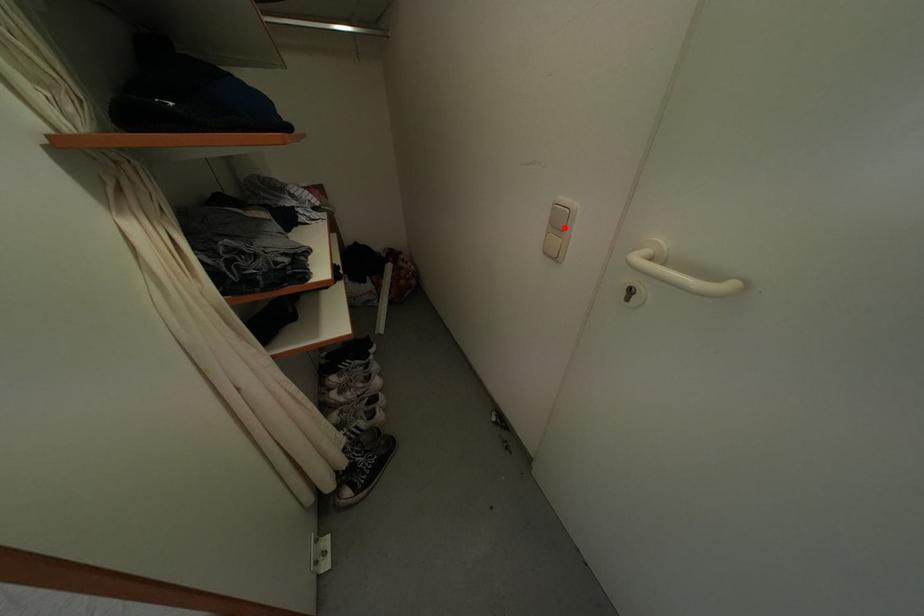
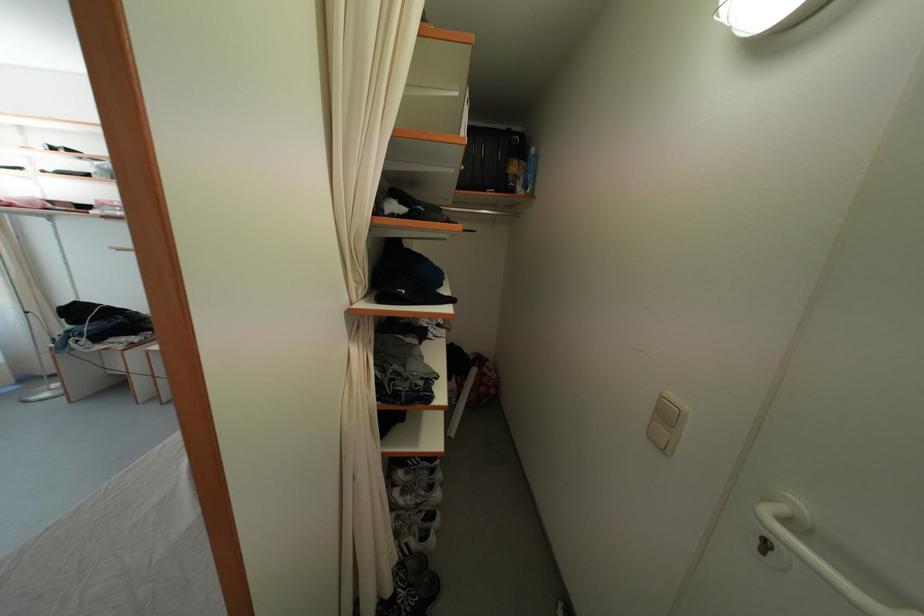
Where in the second image is the point corresponding to the highlighted location from the first image?

(672, 421)